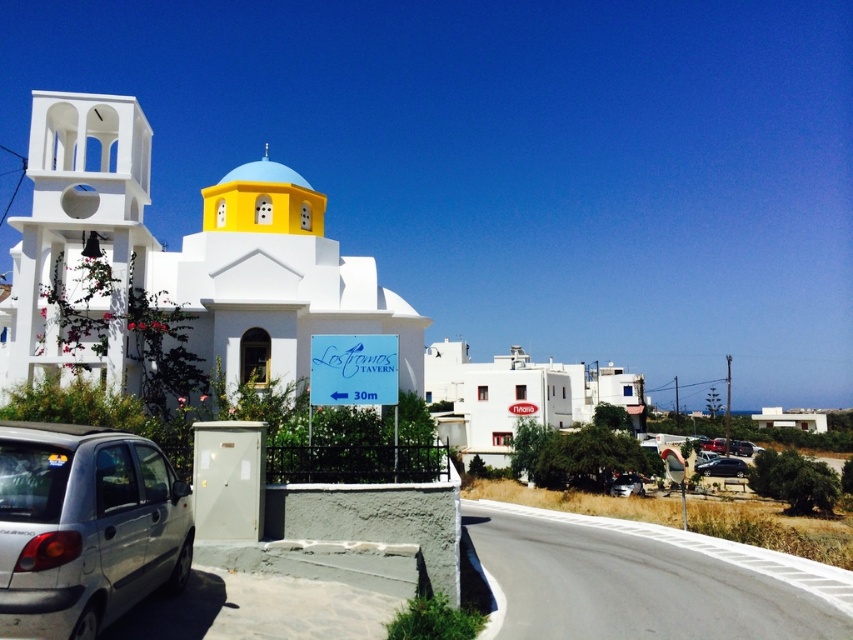
You are a tourist standing in front of the signboard and want to take a photo of both the white matte church at left and the shiny black sedan at lower right. Which object should you position closer to the center of your camera frame to ensure both fit in the shot?

You should position the white matte church at left closer to the center of your camera frame since it is wider than the shiny black sedan at lower right, allowing both to fit within the frame more effectively.

You are standing in front of the white matte church at left and want to walk to the shiny black sedan at lower right. Which direction should you move relative to the church?

Since the white matte church at left is closer to the viewer than the shiny black sedan at lower right, you should move towards the right direction away from the church to reach the shiny black sedan at lower right.

You are standing at the origin point in the image. The white matte church at left is located at coordinates given. If you face the direction of the church, which direction should you turn to see the signboard with the arrow pointing left indicating 30m to Los Frangos Tavern?

Since the white matte church at left is positioned at point (x=177, y=268), turning to the right would orient you towards the signboard with the arrow pointing left indicating 30m to Los Frangos Tavern.